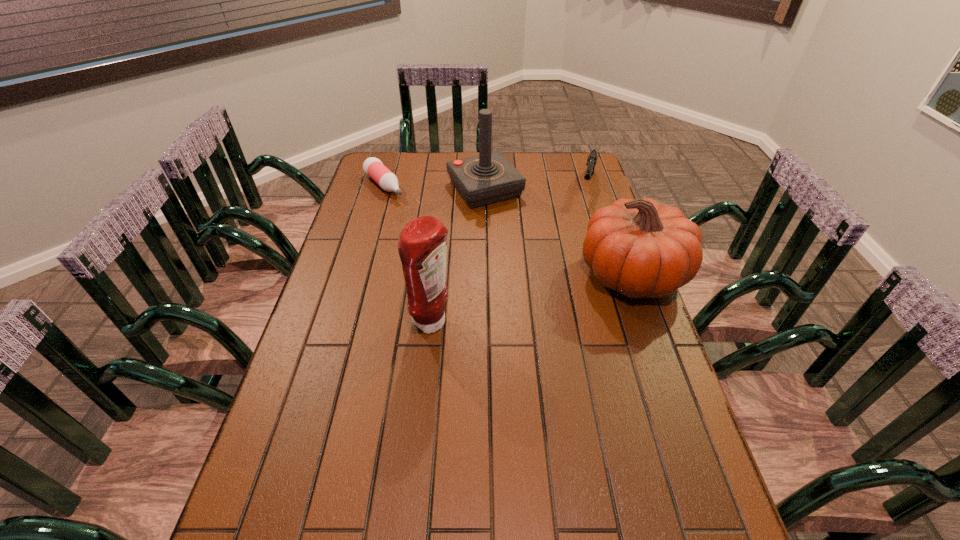
I want to click on free location located 0.250m at the end of the barrel of the second shortest object, so click(x=578, y=244).

The image size is (960, 540). Identify the location of free space located 0.230m at the end of the barrel of the second shortest object. (579, 240).

You are a GUI agent. You are given a task and a screenshot of the screen. Output one action in this format:
    pyautogui.click(x=<x>, y=<y>)
    Task: Click on the blank area located 0.120m at the end of the barrel of the second shortest object
    
    Given the screenshot: What is the action you would take?
    pyautogui.click(x=584, y=220)

The width and height of the screenshot is (960, 540). In order to click on vacant space located with the cap open on the shortest object in this screenshot , I will do `click(439, 243)`.

This screenshot has width=960, height=540. Identify the location of free space located with the cap open on the shortest object. (426, 231).

Identify the location of vacant space located with the cap open on the shortest object. This screenshot has height=540, width=960. (416, 221).

Locate an element on the screen. This screenshot has height=540, width=960. joystick that is at the far edge is located at coordinates [x=488, y=178].

The image size is (960, 540). I want to click on gun located in the far edge section of the desktop, so click(x=592, y=158).

You are a GUI agent. You are given a task and a screenshot of the screen. Output one action in this format:
    pyautogui.click(x=<x>, y=<y>)
    Task: Click on the bottle that is at the far edge
    This screenshot has height=540, width=960.
    Given the screenshot: What is the action you would take?
    pyautogui.click(x=373, y=167)

Locate an element on the screen. object that is at the left edge is located at coordinates (373, 167).